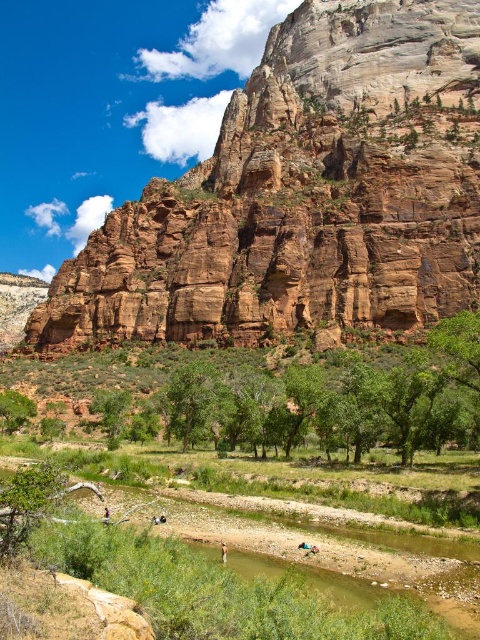
Question: From the image, what is the correct spatial relationship of rustic rock cliff at upper center in relation to light brown leather jacket at lower center?

Choices:
 (A) left
 (B) right

Answer: (B)

Question: Which of the following is the farthest from the observer?

Choices:
 (A) green grassy river at center
 (B) light brown leather jacket at lower center
 (C) smooth skin person at center
 (D) rustic rock cliff at upper center

Answer: (D)

Question: Among these objects, which one is nearest to the camera?

Choices:
 (A) light brown leather jacket at lower center
 (B) rustic rock cliff at upper center
 (C) green grassy river at center

Answer: (C)

Question: Does green grassy river at center have a lesser width compared to light brown leather jacket at lower center?

Choices:
 (A) no
 (B) yes

Answer: (A)

Question: Among these points, which one is nearest to the camera?

Choices:
 (A) (226, 552)
 (B) (104, 513)
 (C) (414, 28)
 (D) (319, 600)

Answer: (D)

Question: Observing the image, what is the correct spatial positioning of rustic rock cliff at upper center in reference to smooth skin person at center?

Choices:
 (A) below
 (B) above

Answer: (B)